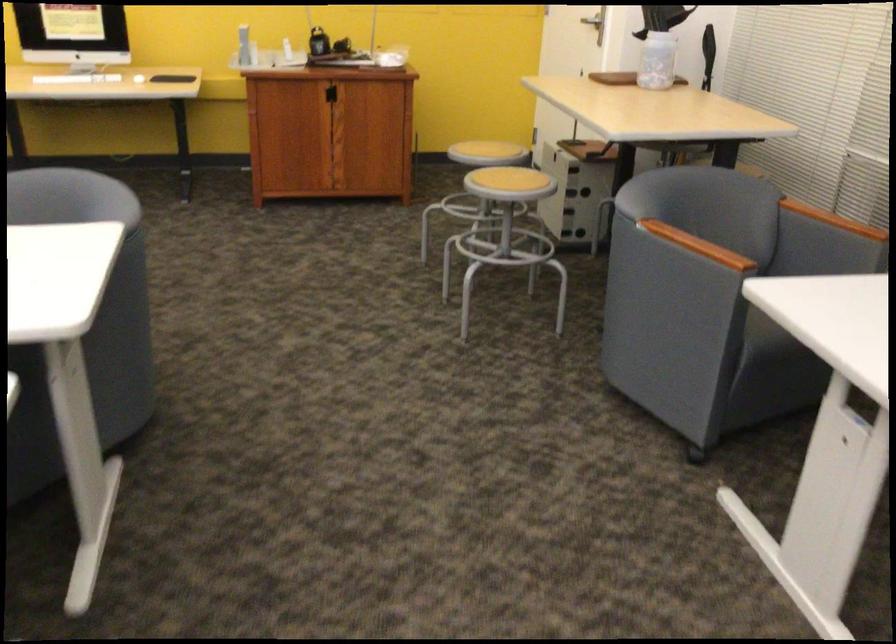
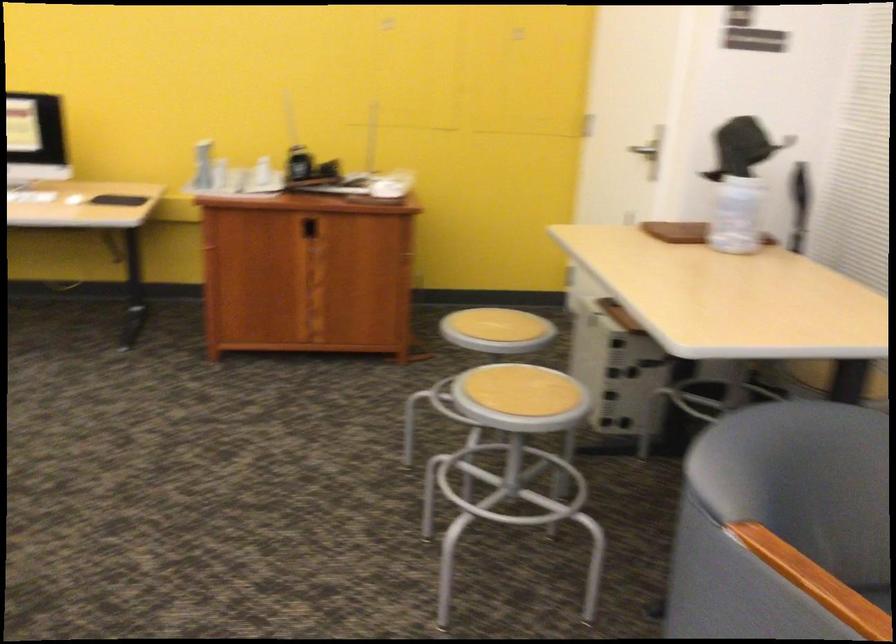
Question: The images are taken continuously from a first-person perspective. In which direction are you moving?

Choices:
 (A) Left
 (B) Right
 (C) Forward
 (D) Backward

Answer: (C)